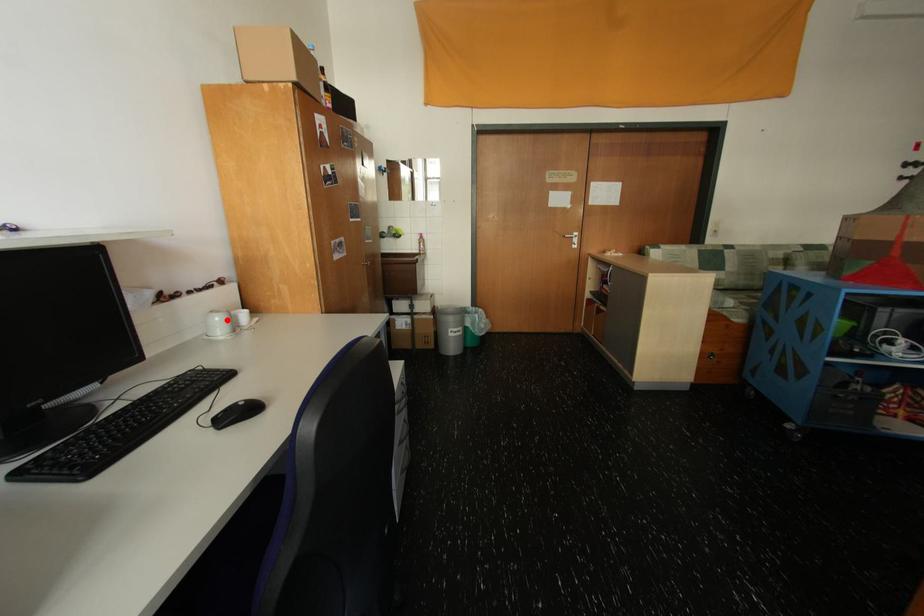
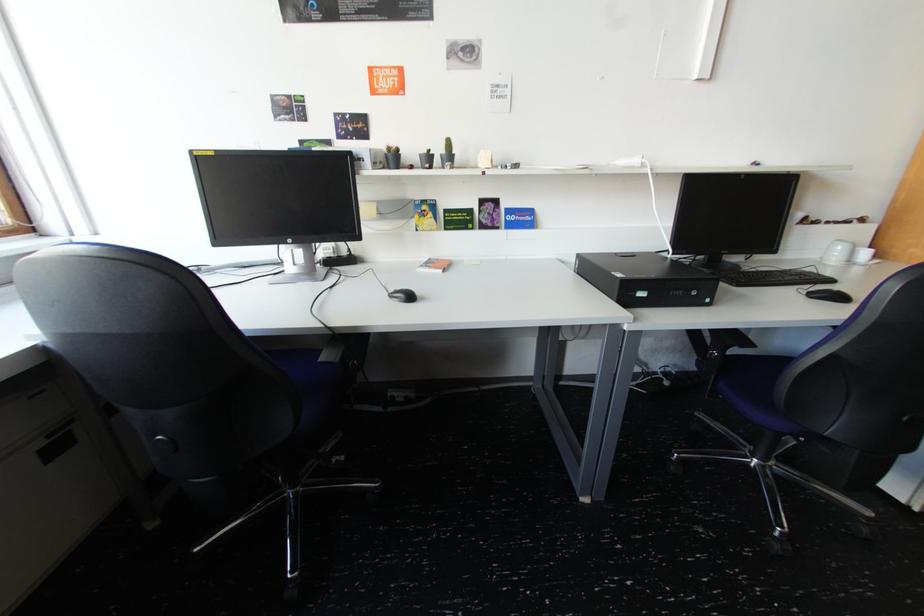
In the second image, find the point that corresponds to the highlighted location in the first image.

(849, 249)